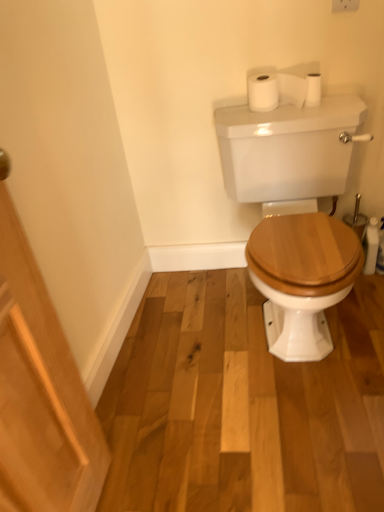
Question: Does white matte toilet paper at upper center, which is the 1th toilet paper from left to right, appear on the left side of white matte toilet paper at upper right, the first toilet paper when ordered from right to left?

Choices:
 (A) yes
 (B) no

Answer: (A)

Question: Is white matte toilet paper at upper center, which is counted as the second toilet paper, starting from the right, positioned in front of white matte toilet paper at upper right, the first toilet paper when ordered from right to left?

Choices:
 (A) no
 (B) yes

Answer: (B)

Question: From the image's perspective, would you say white matte toilet paper at upper center, which is counted as the second toilet paper, starting from the right, is positioned over white matte toilet paper at upper right, the first toilet paper when ordered from right to left?

Choices:
 (A) yes
 (B) no

Answer: (A)

Question: Is white matte toilet paper at upper center, which is the 1th toilet paper from left to right, facing towards white matte toilet paper at upper right, the first toilet paper when ordered from right to left?

Choices:
 (A) no
 (B) yes

Answer: (A)

Question: Can you confirm if white matte toilet paper at upper center, which is counted as the second toilet paper, starting from the right, is thinner than white matte toilet paper at upper right, the 2th toilet paper viewed from the left?

Choices:
 (A) no
 (B) yes

Answer: (A)

Question: From the image's perspective, is white matte toilet paper at upper right, the 2th toilet paper viewed from the left, positioned above or below white matte toilet paper at upper center, which is the 1th toilet paper from left to right?

Choices:
 (A) above
 (B) below

Answer: (B)

Question: Is white matte toilet paper at upper right, the 2th toilet paper viewed from the left, to the left or to the right of white matte toilet paper at upper center, which is counted as the second toilet paper, starting from the right, in the image?

Choices:
 (A) left
 (B) right

Answer: (B)

Question: Does point [x=316, y=84] appear closer or farther from the camera than point [x=271, y=79]?

Choices:
 (A) farther
 (B) closer

Answer: (A)

Question: In terms of size, does white matte toilet paper at upper right, the 2th toilet paper viewed from the left, appear bigger or smaller than white matte toilet paper at upper center, which is counted as the second toilet paper, starting from the right?

Choices:
 (A) big
 (B) small

Answer: (B)

Question: Is white matte toilet paper at upper center, which is the 1th toilet paper from left to right, in front of or behind white matte toilet paper at upper right, the 2th toilet paper viewed from the left, in the image?

Choices:
 (A) behind
 (B) front

Answer: (B)

Question: In terms of width, does white matte toilet paper at upper center, which is counted as the second toilet paper, starting from the right, look wider or thinner when compared to white matte toilet paper at upper right, the 2th toilet paper viewed from the left?

Choices:
 (A) wide
 (B) thin

Answer: (A)

Question: Is point (276, 77) closer or farther from the camera than point (314, 93)?

Choices:
 (A) closer
 (B) farther

Answer: (A)

Question: Is white matte toilet paper at upper center, which is counted as the second toilet paper, starting from the right, spatially inside white matte toilet paper at upper right, the 2th toilet paper viewed from the left, or outside of it?

Choices:
 (A) outside
 (B) inside

Answer: (A)

Question: Is white matte toilet paper at upper right, the 2th toilet paper viewed from the left, in front of or behind white glossy porcelain at center in the image?

Choices:
 (A) front
 (B) behind

Answer: (B)

Question: Is white matte toilet paper at upper right, the 2th toilet paper viewed from the left, inside the boundaries of white glossy porcelain at center, or outside?

Choices:
 (A) inside
 (B) outside

Answer: (B)